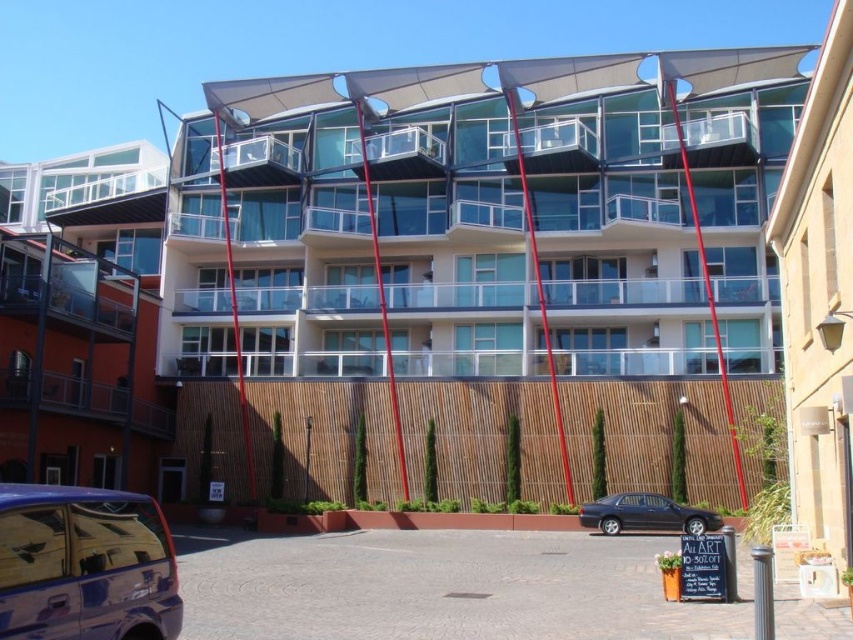
You are a delivery driver who needs to park your truck between the shiny metallic van at lower left and the glossy black sedan at lower center. The truck requires a 120 feet space. Is there enough space between them?

The shiny metallic van at lower left and glossy black sedan at lower center are 123.80 feet apart from each other. Since the truck requires 120 feet, there is enough space between them to park the truck.

You are a delivery person who needs to park your vehicle in a covered parking spot that has a height restriction of 1.8 meters. You have a shiny metallic van at lower left and a glossy black sedan at lower center. Which vehicle can safely park there without exceeding the height limit?

The glossy black sedan at lower center can safely park in the covered parking spot since it has a lesser height compared to the shiny metallic van at lower left, which exceeds the 1.8 meters height restriction.